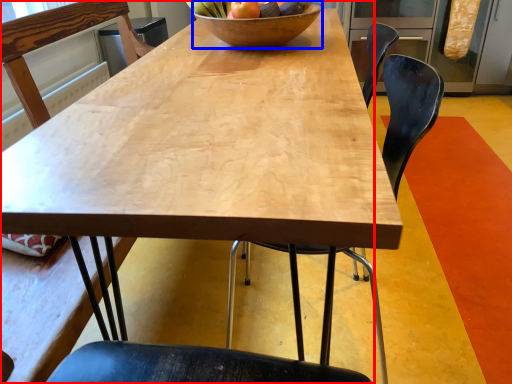
Question: Which of the following is the closest to the observer, chair (highlighted by a red box) or bowl (highlighted by a blue box)?

Choices:
 (A) chair
 (B) bowl

Answer: (A)